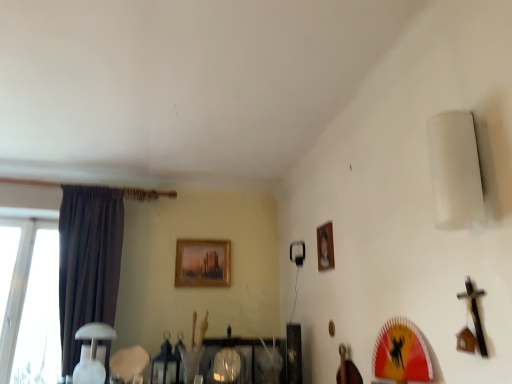
Question: Relative to white glossy table lamp at lower left, is dark fabric curtain at left in front or behind?

Choices:
 (A) behind
 (B) front

Answer: (A)

Question: Would you say dark fabric curtain at left is inside or outside white glossy table lamp at lower left?

Choices:
 (A) inside
 (B) outside

Answer: (B)

Question: Considering the real-world distances, which object is farthest from the dark fabric curtain at left?

Choices:
 (A) white glossy table lamp at lower left
 (B) wooden picture frame at upper center, placed as the second picture frame when sorted from left to right
 (C) wooden framed painting at upper center, placed as the first picture frame when sorted from left to right

Answer: (B)

Question: Based on their relative distances, which object is nearer to the wooden framed painting at upper center, the 2th picture frame from the front?

Choices:
 (A) dark fabric curtain at left
 (B) wooden picture frame at upper center, the 1th picture frame in the right-to-left sequence
 (C) white glossy table lamp at lower left

Answer: (A)